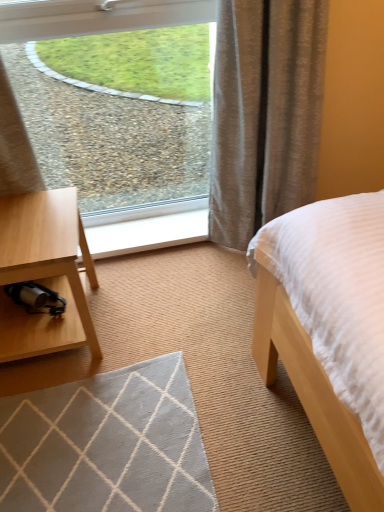
Identify the location of blank space above white wood at center (from a real-world perspective). (153, 229).